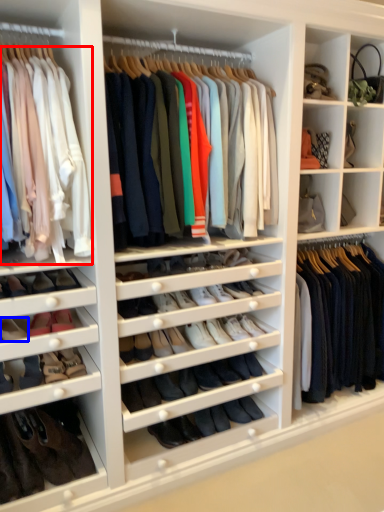
Question: Which object appears closest to the camera in this image, clothing (highlighted by a red box) or shoe (highlighted by a blue box)?

Choices:
 (A) clothing
 (B) shoe

Answer: (A)